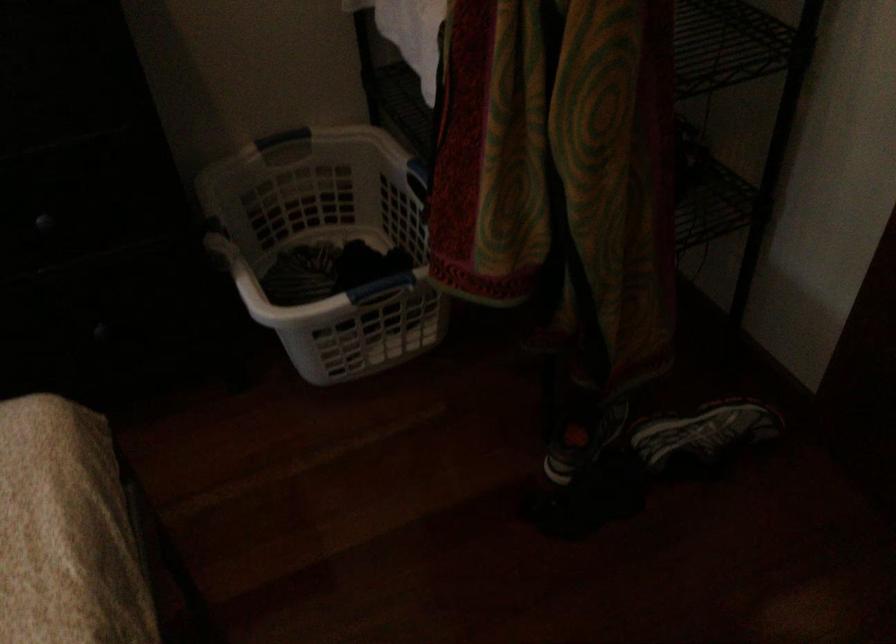
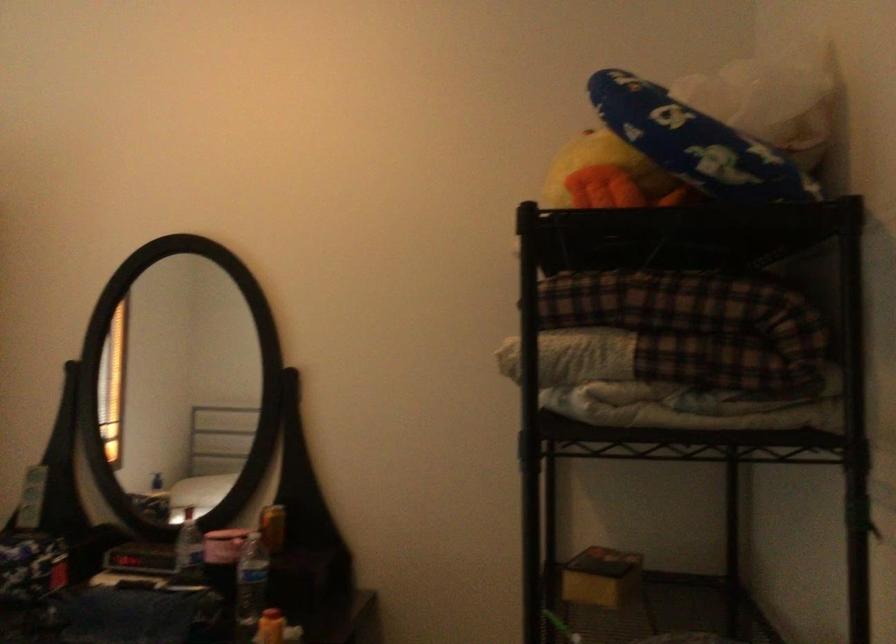
Based on the continuous images, in which direction is the camera rotating?

The camera rotated toward left-up.